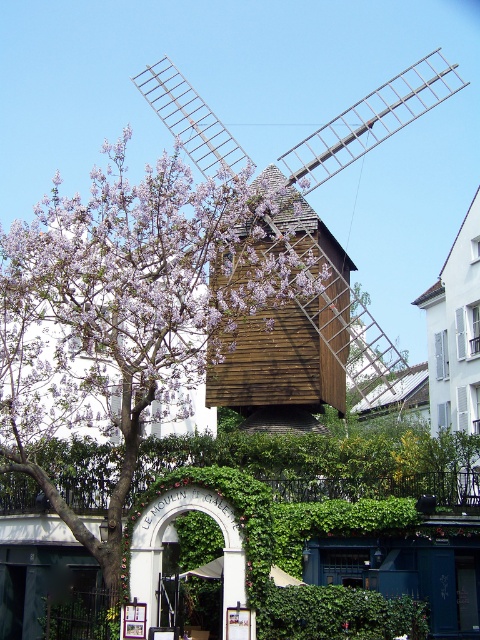
Question: Which of the following is the farthest from the observer?

Choices:
 (A) wooden windmill at center
 (B) purple leafy tree at center

Answer: (A)

Question: Does purple leafy tree at center have a greater width compared to wooden windmill at center?

Choices:
 (A) no
 (B) yes

Answer: (A)

Question: Which point appears closest to the camera in this image?

Choices:
 (A) (446, 84)
 (B) (131, 454)

Answer: (B)

Question: Considering the relative positions of purple leafy tree at center and wooden windmill at center in the image provided, where is purple leafy tree at center located with respect to wooden windmill at center?

Choices:
 (A) above
 (B) below

Answer: (B)

Question: Which object is closer to the camera taking this photo?

Choices:
 (A) purple leafy tree at center
 (B) wooden windmill at center

Answer: (A)

Question: Does purple leafy tree at center lie behind wooden windmill at center?

Choices:
 (A) no
 (B) yes

Answer: (A)